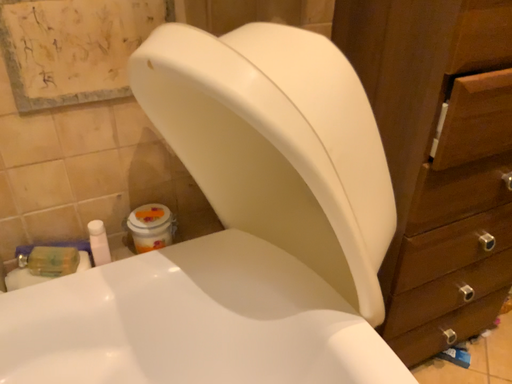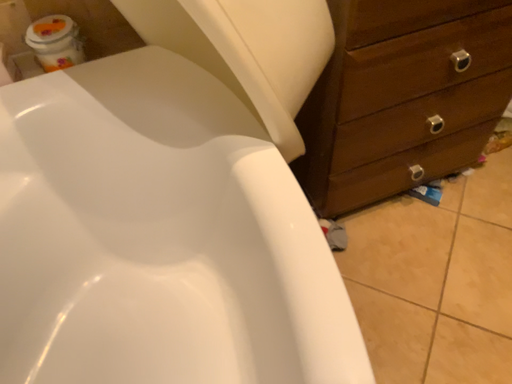
Question: Which way did the camera rotate in the video?

Choices:
 (A) rotated downward
 (B) rotated upward

Answer: (A)